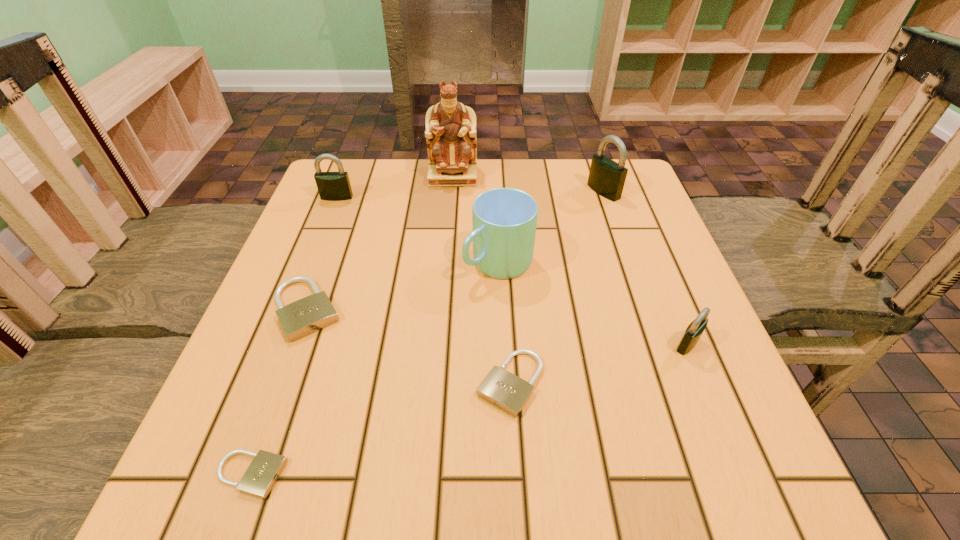
You are a GUI agent. You are given a task and a screenshot of the screen. Output one action in this format:
    pyautogui.click(x=<x>, y=<y>)
    Task: Click on the free space that satisfies the following two spatial constraints: 1. on the front side of the mug; 2. on the right side of the fourth tallest object
    
    Given the screenshot: What is the action you would take?
    pyautogui.click(x=311, y=262)

This screenshot has height=540, width=960. I want to click on vacant region that satisfies the following two spatial constraints: 1. on the front-facing side of the figurine; 2. on the right side of the biggest black padlock, so click(452, 191).

Image resolution: width=960 pixels, height=540 pixels. In order to click on free spot that satisfies the following two spatial constraints: 1. on the front side of the leftmost black padlock; 2. on the left side of the fifth tallest object in this screenshot , I will do `click(279, 344)`.

Locate an element on the screen. Image resolution: width=960 pixels, height=540 pixels. free space that satisfies the following two spatial constraints: 1. on the front side of the fourth shortest padlock; 2. on the right side of the biggest black padlock is located at coordinates (657, 344).

Image resolution: width=960 pixels, height=540 pixels. Identify the location of vacant region that satisfies the following two spatial constraints: 1. on the front-facing side of the nearest black padlock; 2. on the left side of the tallest object. (440, 344).